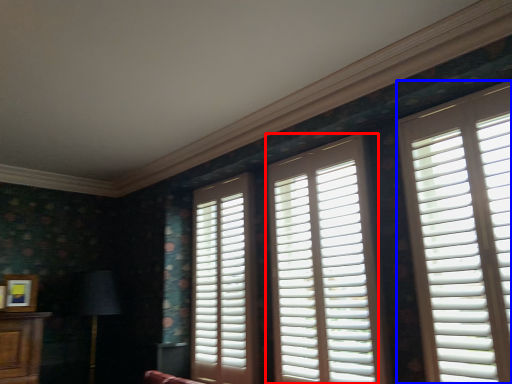
Question: Which point is closer to the camera, window (highlighted by a red box) or window (highlighted by a blue box)?

Choices:
 (A) window
 (B) window

Answer: (B)